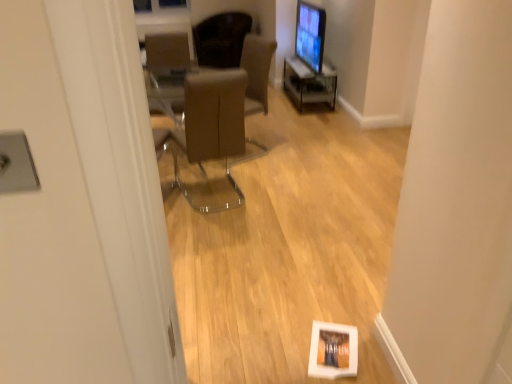
Question: Should I look upward or downward to see brown leather chair at center, the third chair positioned from the top?

Choices:
 (A) up
 (B) down

Answer: (A)

Question: Does brown leather chair at center, the first chair when ordered from front to back, appear on the left side of dark brown leather chair at upper center, the third chair when ordered from bottom to top?

Choices:
 (A) yes
 (B) no

Answer: (B)

Question: From a real-world perspective, is brown leather chair at center, the third chair positioned from the top, positioned under dark brown leather chair at upper center, the first chair viewed from the back, based on gravity?

Choices:
 (A) yes
 (B) no

Answer: (A)

Question: Is brown leather chair at center, the third chair positioned from the back, far away from dark brown leather chair at upper center, the first chair viewed from the back?

Choices:
 (A) no
 (B) yes

Answer: (B)

Question: From the image's perspective, is brown leather chair at center, the first chair in the bottom-to-top sequence, under dark brown leather chair at upper center, the third chair when ordered from bottom to top?

Choices:
 (A) yes
 (B) no

Answer: (A)

Question: From a real-world perspective, is brown leather chair at center, the third chair positioned from the back, on dark brown leather chair at upper center, the third chair when ordered from bottom to top?

Choices:
 (A) yes
 (B) no

Answer: (B)

Question: Is brown leather chair at center, the third chair positioned from the back, positioned in front of dark brown leather chair at upper center, which is the first chair in top-to-bottom order?

Choices:
 (A) no
 (B) yes

Answer: (B)

Question: Is matte black monitor at upper right positioned in front of brown leather chair at center, which ranks as the second chair in back-to-front order?

Choices:
 (A) yes
 (B) no

Answer: (B)

Question: Is matte black monitor at upper right bigger than brown leather chair at center, which ranks as the second chair in back-to-front order?

Choices:
 (A) no
 (B) yes

Answer: (A)

Question: Is brown leather chair at center, which ranks as the second chair in back-to-front order, completely or partially inside matte black monitor at upper right?

Choices:
 (A) no
 (B) yes

Answer: (A)

Question: Is matte black monitor at upper right next to brown leather chair at center, which ranks as the second chair in back-to-front order, and touching it?

Choices:
 (A) yes
 (B) no

Answer: (B)

Question: Considering the relative sizes of matte black monitor at upper right and brown leather chair at center, the 2th chair when ordered from bottom to top, in the image provided, is matte black monitor at upper right smaller than brown leather chair at center, the 2th chair when ordered from bottom to top,?

Choices:
 (A) yes
 (B) no

Answer: (A)

Question: Considering the relative sizes of matte black monitor at upper right and brown leather chair at center, the 2th chair when ordered from bottom to top, in the image provided, is matte black monitor at upper right shorter than brown leather chair at center, the 2th chair when ordered from bottom to top,?

Choices:
 (A) no
 (B) yes

Answer: (B)

Question: Is dark brown leather chair at upper center, the first chair viewed from the back, taller than matte black monitor at upper right?

Choices:
 (A) no
 (B) yes

Answer: (A)